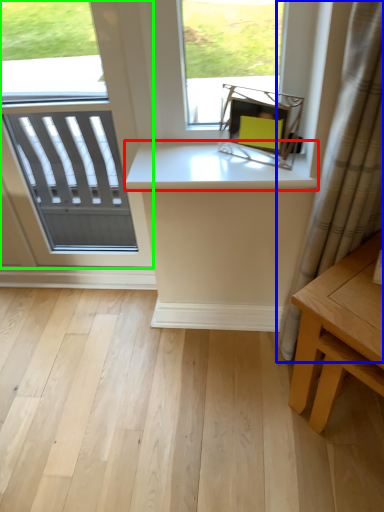
Question: Which object is positioned closest to counter top (highlighted by a red box)? Select from curtain (highlighted by a blue box) and window (highlighted by a green box).

Choices:
 (A) curtain
 (B) window

Answer: (A)